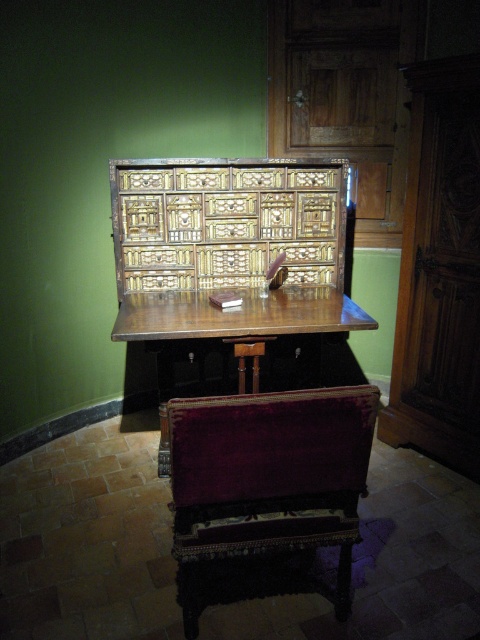
Does velvet burgundy chair at lower center lie in front of polished wood table at center?

That is True.

I want to click on velvet burgundy chair at lower center, so click(267, 477).

What are the coordinates of `velvet burgundy chair at lower center` in the screenshot? It's located at (267, 477).

Can you confirm if velvet burgundy chair at lower center is wider than wooden stool at center?

Indeed, velvet burgundy chair at lower center has a greater width compared to wooden stool at center.

Does velvet burgundy chair at lower center appear under wooden stool at center?

Correct, velvet burgundy chair at lower center is located below wooden stool at center.

The width and height of the screenshot is (480, 640). What do you see at coordinates (267, 477) in the screenshot? I see `velvet burgundy chair at lower center` at bounding box center [267, 477].

Locate an element on the screen. This screenshot has height=640, width=480. velvet burgundy chair at lower center is located at coordinates (267, 477).

Is polished wood table at center taller than wooden stool at center?

Yes.

Can you confirm if polished wood table at center is wider than wooden stool at center?

Yes.

This screenshot has width=480, height=640. I want to click on polished wood table at center, so click(231, 326).